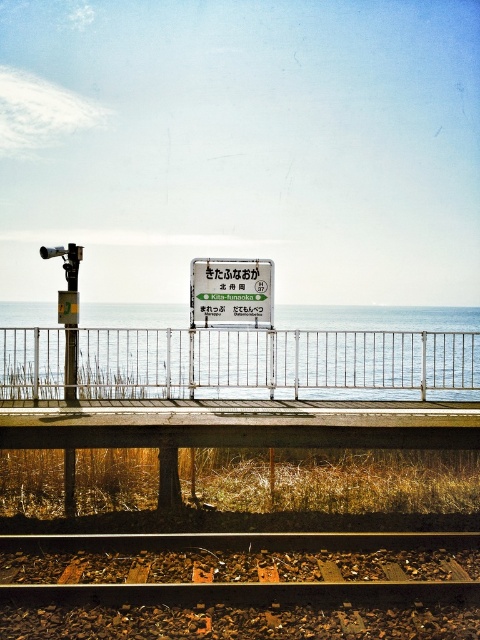
Question: Observing the image, what is the correct spatial positioning of blue water at center in reference to metallic sign at center?

Choices:
 (A) below
 (B) above

Answer: (A)

Question: Which of the following is the closest to the observer?

Choices:
 (A) (350, 355)
 (B) (219, 305)

Answer: (A)

Question: Does blue water at center appear on the left side of metallic sign at center?

Choices:
 (A) yes
 (B) no

Answer: (A)

Question: In this image, where is blue water at center located relative to metallic sign at center?

Choices:
 (A) right
 (B) left

Answer: (B)

Question: Which of the following is the closest to the observer?

Choices:
 (A) click(x=302, y=310)
 (B) click(x=259, y=298)

Answer: (B)